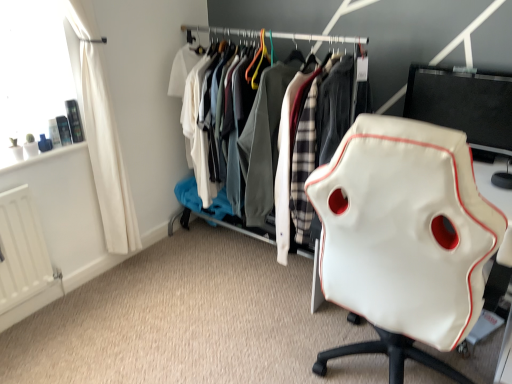
Question: From the image's perspective, relative to white leather chair at right, is black glossy monitor at upper right above or below?

Choices:
 (A) below
 (B) above

Answer: (B)

Question: From a real-world perspective, is black glossy monitor at upper right positioned above or below white leather chair at right?

Choices:
 (A) below
 (B) above

Answer: (B)

Question: Which object is the closest to the white leather jacket at center?

Choices:
 (A) white leather chair at right
 (B) black glossy monitor at upper right
 (C) white matte radiator at lower left
 (D) white fabric curtain at left

Answer: (B)

Question: Which object is positioned farthest from the white fabric curtain at left?

Choices:
 (A) white leather chair at right
 (B) black glossy monitor at upper right
 (C) white matte radiator at lower left
 (D) white leather jacket at center

Answer: (B)